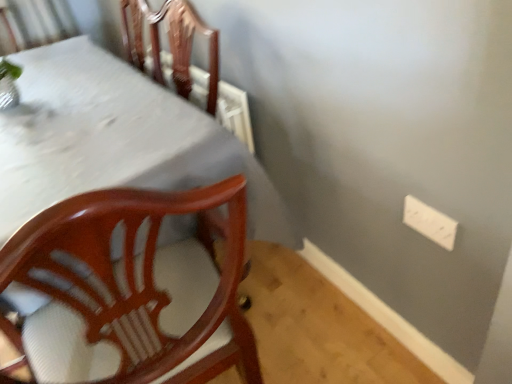
Describe the element at coordinates (116, 140) in the screenshot. I see `white glossy table at upper left` at that location.

This screenshot has width=512, height=384. What are the coordinates of `white glossy table at upper left` in the screenshot? It's located at (116, 140).

The image size is (512, 384). In order to click on white plastic electric outlet at upper right in this screenshot , I will do `click(430, 222)`.

What do you see at coordinates (430, 222) in the screenshot? I see `white plastic electric outlet at upper right` at bounding box center [430, 222].

In order to face white plastic electric outlet at upper right, should I rotate leftwards or rightwards?

Rotate right and turn 21.558 degrees.

The image size is (512, 384). In order to click on white glossy table at upper left in this screenshot , I will do `click(116, 140)`.

Does white glossy table at upper left appear on the left side of white plastic electric outlet at upper right?

Correct, you'll find white glossy table at upper left to the left of white plastic electric outlet at upper right.

Is white glossy table at upper left in front of or behind white plastic electric outlet at upper right in the image?

Visually, white glossy table at upper left is located in front of white plastic electric outlet at upper right.

Does point (41, 109) appear closer or farther from the camera than point (450, 230)?

Point (41, 109) is positioned farther from the camera compared to point (450, 230).

From the image's perspective, between white glossy table at upper left and white plastic electric outlet at upper right, which one is located above?

white plastic electric outlet at upper right, from the image's perspective.

From a real-world perspective, is white glossy table at upper left located beneath white plastic electric outlet at upper right?

Indeed, from a real-world perspective, white glossy table at upper left is positioned beneath white plastic electric outlet at upper right.

Considering the sizes of white glossy table at upper left and white plastic electric outlet at upper right in the image, is white glossy table at upper left wider or thinner than white plastic electric outlet at upper right?

Clearly, white glossy table at upper left has more width compared to white plastic electric outlet at upper right.

Is white glossy table at upper left shorter than white plastic electric outlet at upper right?

Incorrect, the height of white glossy table at upper left does not fall short of that of white plastic electric outlet at upper right.

Between white glossy table at upper left and white plastic electric outlet at upper right, which one has smaller size?

With smaller size is white plastic electric outlet at upper right.

Could white plastic electric outlet at upper right be considered to be inside white glossy table at upper left?

No, white plastic electric outlet at upper right is not surrounded by white glossy table at upper left.

Is white glossy table at upper left placed right next to white plastic electric outlet at upper right?

They are not placed beside each other.

Is white glossy table at upper left aimed at white plastic electric outlet at upper right?

No, white glossy table at upper left is not aimed at white plastic electric outlet at upper right.

Image resolution: width=512 pixels, height=384 pixels. I want to click on table lying on the left of white plastic electric outlet at upper right, so click(x=116, y=140).

Which is more to the right, white plastic electric outlet at upper right or white glossy table at upper left?

From the viewer's perspective, white plastic electric outlet at upper right appears more on the right side.

Is white plastic electric outlet at upper right behind white glossy table at upper left?

That is True.

Is point (442, 223) positioned before point (33, 130)?

Yes, point (442, 223) is in front of point (33, 130).

From the image's perspective, is white plastic electric outlet at upper right over white glossy table at upper left?

Yes, from the image's perspective, white plastic electric outlet at upper right is over white glossy table at upper left.

From a real-world perspective, is white plastic electric outlet at upper right beneath white glossy table at upper left?

No, from a real-world perspective, white plastic electric outlet at upper right is not below white glossy table at upper left.

Does white plastic electric outlet at upper right have a greater width compared to white glossy table at upper left?

No.

Considering the sizes of white plastic electric outlet at upper right and white glossy table at upper left in the image, is white plastic electric outlet at upper right taller or shorter than white glossy table at upper left?

In the image, white plastic electric outlet at upper right appears to be shorter than white glossy table at upper left.

Who is smaller, white plastic electric outlet at upper right or white glossy table at upper left?

white plastic electric outlet at upper right is smaller.

Is white plastic electric outlet at upper right inside or outside of white glossy table at upper left?

white plastic electric outlet at upper right is spatially situated outside white glossy table at upper left.

Is white plastic electric outlet at upper right far away from white glossy table at upper left?

No.

From the picture: Is white plastic electric outlet at upper right aimed at white glossy table at upper left?

Yes, white plastic electric outlet at upper right faces towards white glossy table at upper left.

This screenshot has height=384, width=512. I want to click on table that is under the white plastic electric outlet at upper right (from a real-world perspective), so click(x=116, y=140).

This screenshot has height=384, width=512. I want to click on table that is on the left side of white plastic electric outlet at upper right, so click(x=116, y=140).

Locate an element on the screen. This screenshot has height=384, width=512. table located underneath the white plastic electric outlet at upper right (from a real-world perspective) is located at coordinates (116, 140).